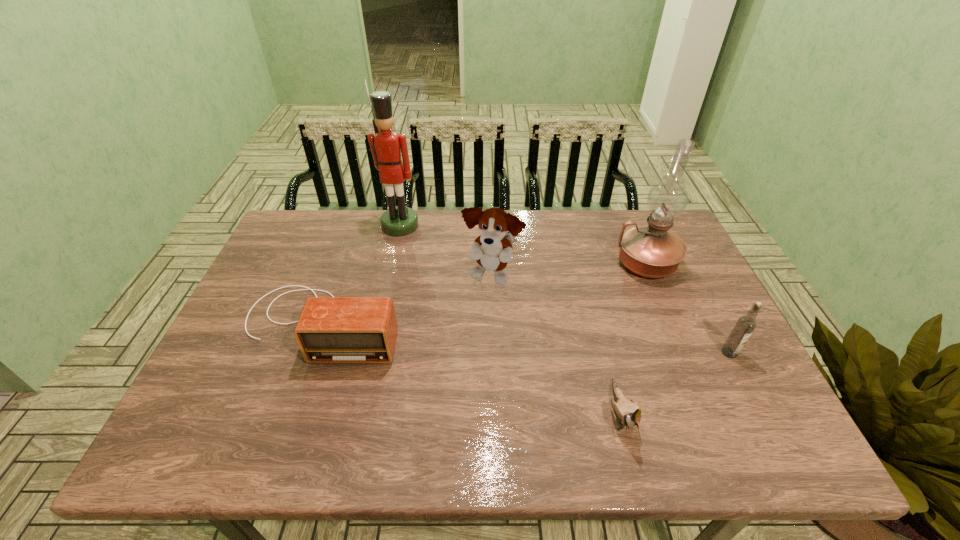
The height and width of the screenshot is (540, 960). In order to click on the tallest object in this screenshot , I will do `click(386, 146)`.

Where is `nutcracker`? This screenshot has width=960, height=540. nutcracker is located at coordinates (386, 146).

Where is `the second tallest object`? Image resolution: width=960 pixels, height=540 pixels. the second tallest object is located at coordinates (652, 251).

The image size is (960, 540). I want to click on puppy, so coord(492,250).

Identify the location of the fourth object from right to left. The width and height of the screenshot is (960, 540). (492, 250).

This screenshot has height=540, width=960. Identify the location of vodka. (745, 325).

At what (x,y) coordinates should I click in order to perform the action: click on radio receiver. Please return your answer as a coordinate pair (x, y). The image size is (960, 540). Looking at the image, I should click on (332, 329).

Where is `the nearest object`? The width and height of the screenshot is (960, 540). the nearest object is located at coordinates (628, 413).

I want to click on bird, so click(x=628, y=413).

Locate an element on the screen. Image resolution: width=960 pixels, height=540 pixels. free location located 0.240m on the front-facing side of the tallest object is located at coordinates (386, 288).